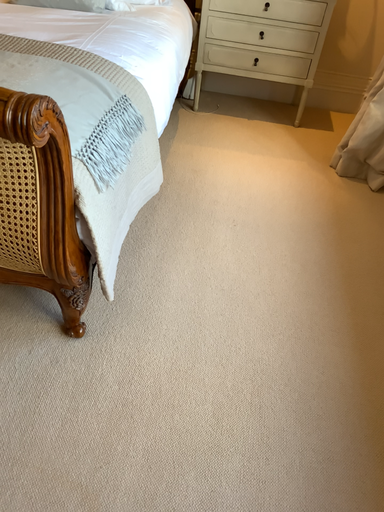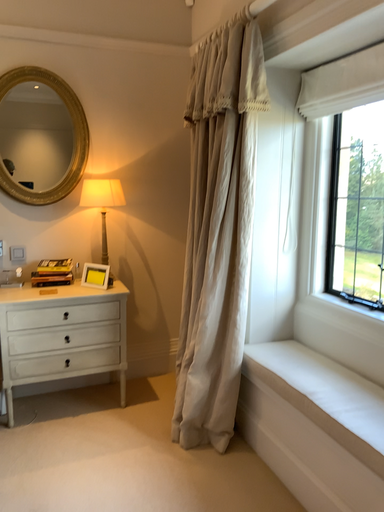
Question: How did the camera likely rotate when shooting the video?

Choices:
 (A) rotated right
 (B) rotated left

Answer: (A)